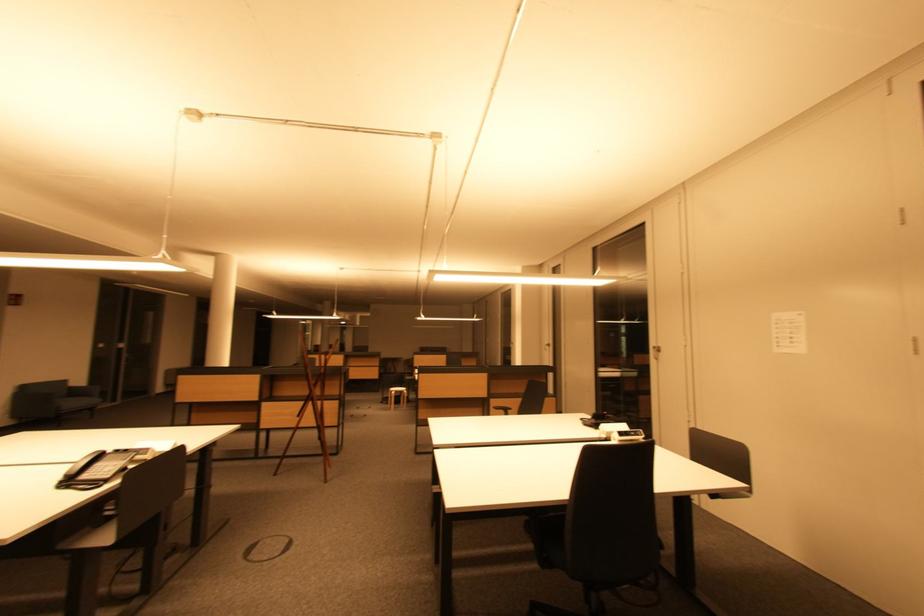
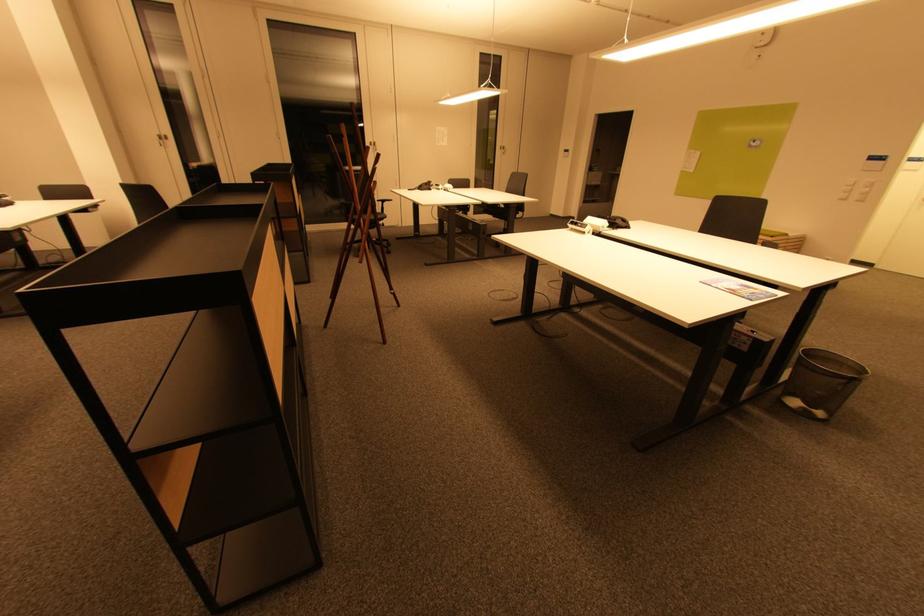
In the second image, find the point that corresponds to point (780, 317) in the first image.

(442, 130)